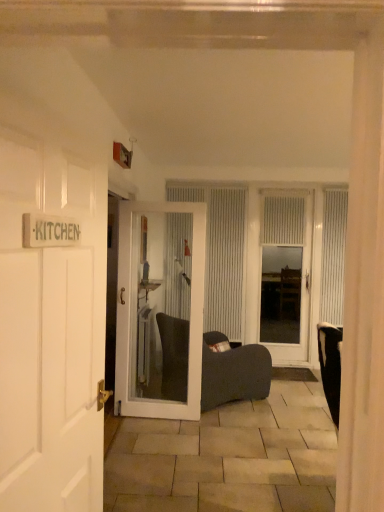
This screenshot has width=384, height=512. I want to click on vacant space to the right of white glossy door at center, arranged as the second door when viewed from the front, so click(215, 426).